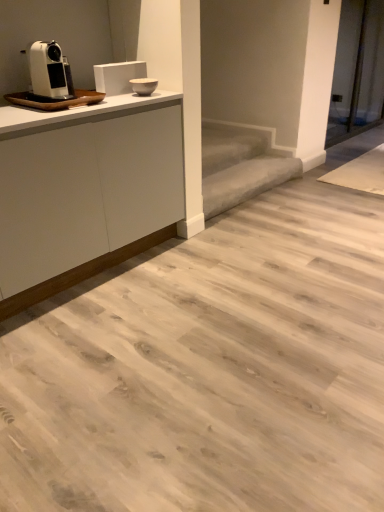
Question: Looking at their shapes, would you say gray carpeted stair at center is wider or thinner than white plastic coffee machine at left?

Choices:
 (A) wide
 (B) thin

Answer: (A)

Question: Looking at the image, does gray carpeted stair at center seem bigger or smaller compared to white plastic coffee machine at left?

Choices:
 (A) big
 (B) small

Answer: (A)

Question: Estimate the real-world distances between objects in this image. Which object is closer to the white plastic coffee machine at left?

Choices:
 (A) white matte cabinet at upper left
 (B) gray carpeted stair at center

Answer: (A)

Question: Which object is positioned farthest from the white matte cabinet at upper left?

Choices:
 (A) gray carpeted stair at center
 (B) white plastic coffee machine at left

Answer: (A)